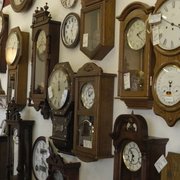
Find the location of `clocks`. clocks is located at coordinates (38, 160), (128, 156), (90, 94), (6, 44), (41, 49), (68, 27), (139, 33), (173, 43), (171, 82).